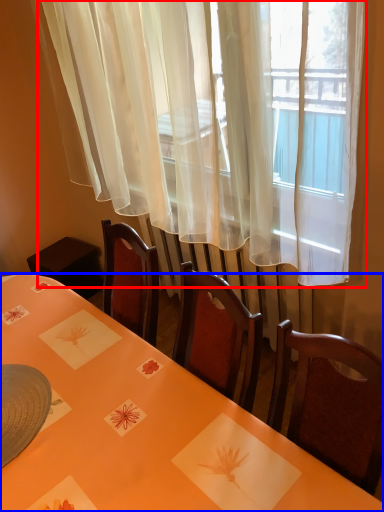
Question: Which object appears closest to the camera in this image, curtain (highlighted by a red box) or table (highlighted by a blue box)?

Choices:
 (A) curtain
 (B) table

Answer: (B)